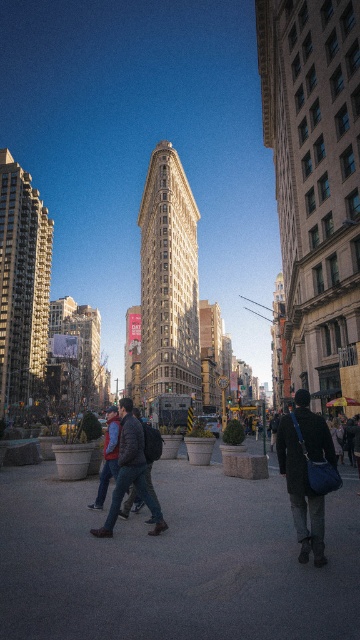
Question: Which point appears farthest from the camera in this image?

Choices:
 (A) (115, 506)
 (B) (39, 554)

Answer: (A)

Question: Is the position of matte black jacket at center more distant than that of dark blue jeans at center?

Choices:
 (A) no
 (B) yes

Answer: (A)

Question: Is dark gray concrete pavement at center smaller than matte black jacket at center?

Choices:
 (A) no
 (B) yes

Answer: (A)

Question: Which object appears farthest from the camera in this image?

Choices:
 (A) dark gray concrete pavement at center
 (B) dark blue jeans at center

Answer: (B)

Question: Does matte black jacket at center have a smaller size compared to dark blue jeans at center?

Choices:
 (A) yes
 (B) no

Answer: (A)

Question: Considering the real-world distances, which object is closest to the matte black jacket at center?

Choices:
 (A) dark blue jeans at center
 (B) dark gray concrete pavement at center

Answer: (B)